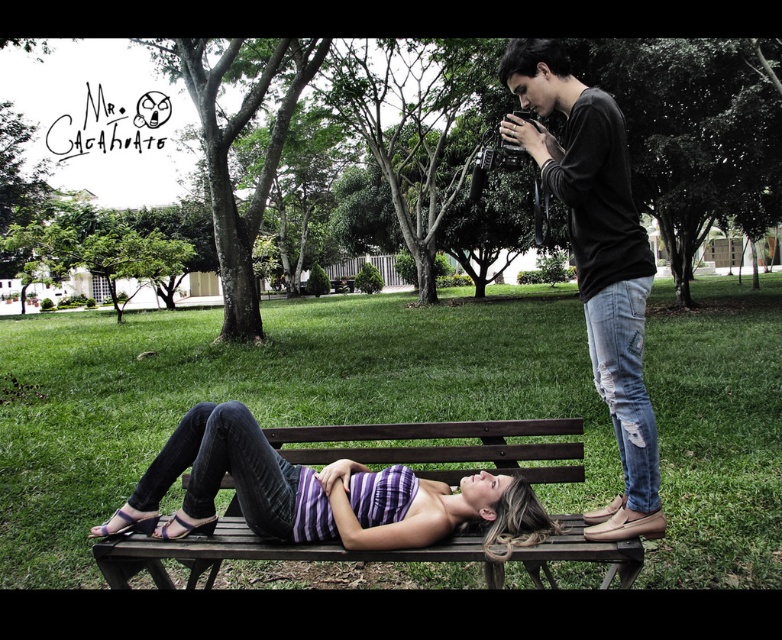
Based on the photo, can you confirm if purple striped tank top at center is positioned to the left of black cotton shirt at upper right?

Yes, purple striped tank top at center is to the left of black cotton shirt at upper right.

Is point (223, 403) closer to camera compared to point (630, 257)?

That is False.

Between point (354, 461) and point (504, 129), which one is positioned behind?

Positioned behind is point (504, 129).

Identify the location of purple striped tank top at center. (318, 493).